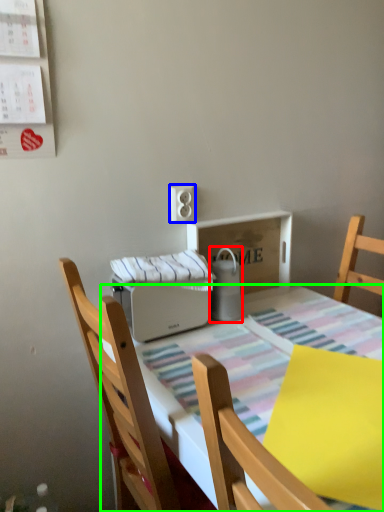
Question: Based on their relative distances, which object is farther from appliance (highlighted by a red box)? Choose from electric outlet (highlighted by a blue box) and kitchen & dining room table (highlighted by a green box).

Choices:
 (A) electric outlet
 (B) kitchen & dining room table

Answer: (B)